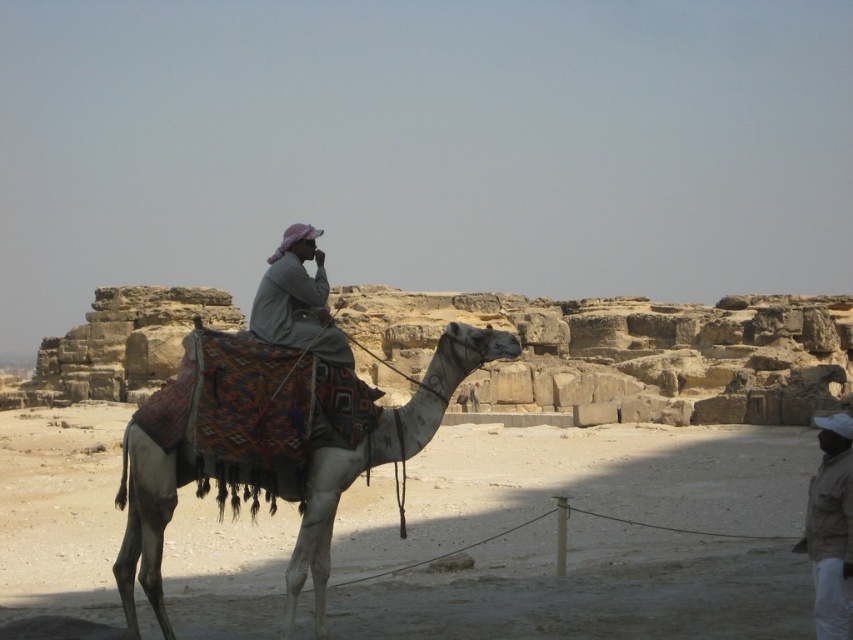
You are a traveler in the desert and see the white textured camel at center and the light beige fabric at center. Which object is taller?

The white textured camel at center is much taller than the light beige fabric at center.

You are a traveler in the desert and need to decide which item to use for shade. You have a tan fabric jacket at lower right and a light beige fabric at center. Based on their sizes, which one can provide more coverage?

The tan fabric jacket at lower right might be wider than light beige fabric at center, so it could provide more coverage for shade.

You are an archaeologist examining the fabrics in the desert scene. You notice the tan fabric jacket at lower right and the light beige fabric at center. Which fabric is positioned higher up in the image?

The tan fabric jacket at lower right is taller than the light beige fabric at center, so the tan fabric jacket at lower right is positioned higher up in the image.